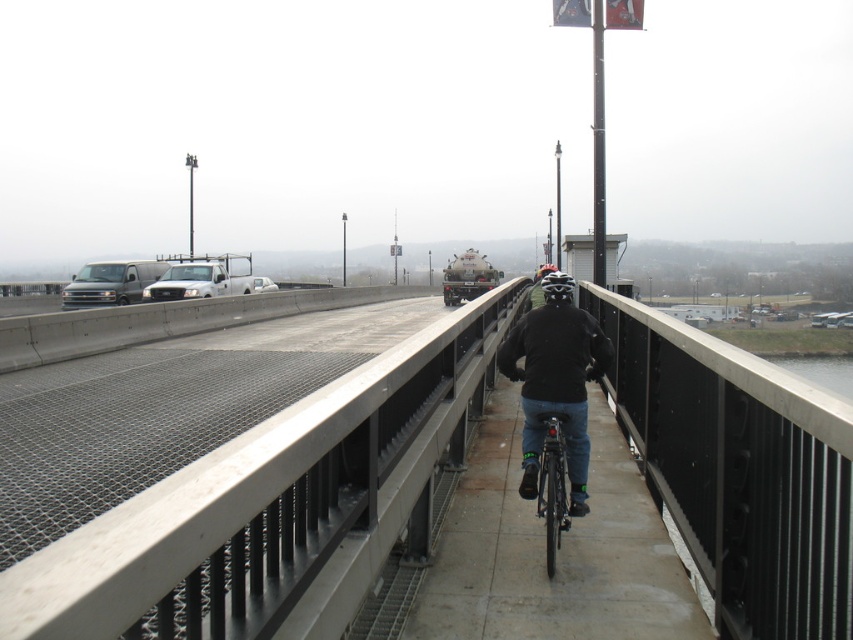
You are a pedestrian standing on the bridge and you see the dark blue jeans at center and the shiny metallic bicycle at center. Which object is closer to you?

The dark blue jeans at center is closer to you because the shiny metallic bicycle at center is behind it.

You are a pedestrian standing on the smooth concrete bridge at center. You want to cross to the left side where the roadway is. Which direction should you walk to reach the left side from the dark blue jeans at center?

The smooth concrete bridge at center is positioned on the right side of dark blue jeans at center, so to reach the left side of the bridge, you should walk towards the left away from the smooth concrete bridge at center.

You are a delivery driver who needs to cross the bridge. You have a delivery van that is 2 meters wide. Can your van safely pass over the smooth concrete bridge at center while avoiding the shiny metallic bicycle at center?

The smooth concrete bridge at center is thinner than the shiny metallic bicycle at center, which means the bridge is narrower than 2 meters. Since the van is 2 meters wide, it cannot safely pass over the bridge.